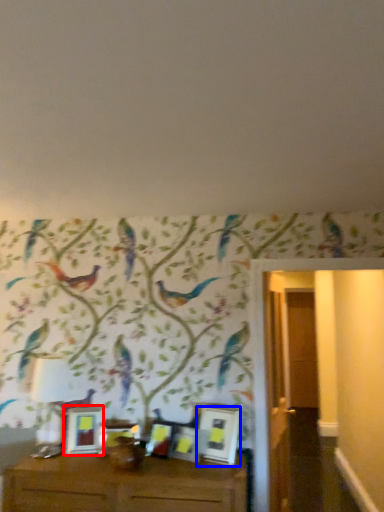
Question: Which object appears farthest to the camera in this image, picture frame (highlighted by a red box) or picture frame (highlighted by a blue box)?

Choices:
 (A) picture frame
 (B) picture frame

Answer: (A)